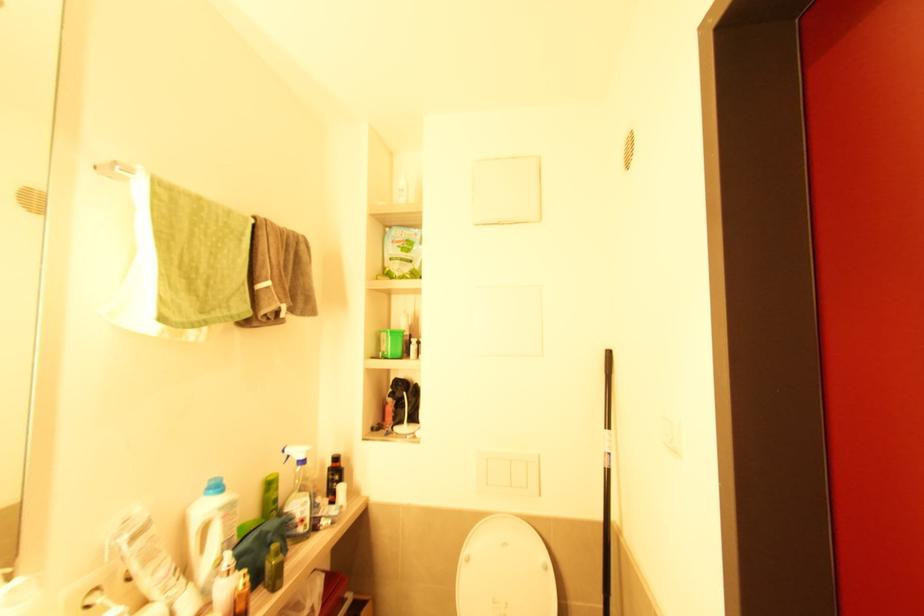
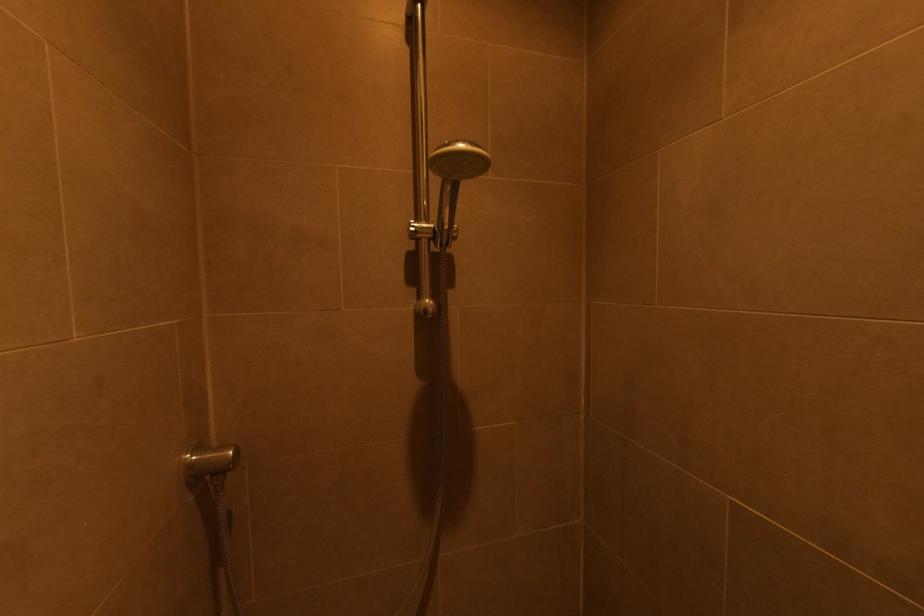
Question: The camera is either moving clockwise (left) or counter-clockwise (right) around the object. The first image is from the beginning of the video and the second image is from the end. Is the camera moving left or right when shooting the video?

Choices:
 (A) Left
 (B) Right

Answer: (B)